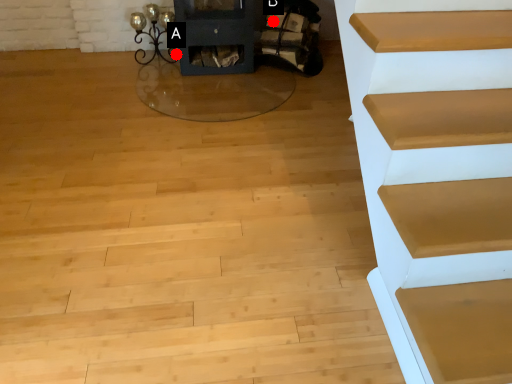
Question: Two points are circled on the image, labeled by A and B beside each circle. Which point is farther to the camera?

Choices:
 (A) A is further
 (B) B is further

Answer: (A)